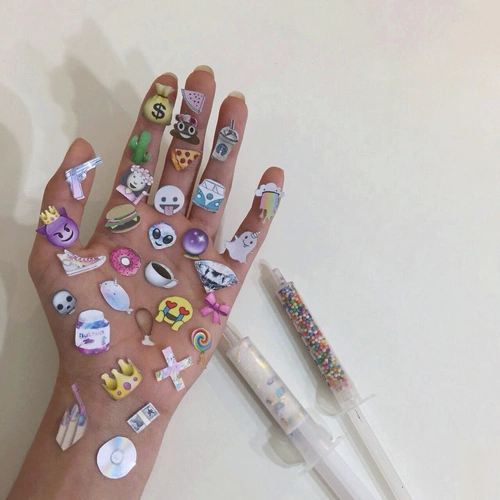
Where is `x sticker`? x sticker is located at coordinates (173, 372).